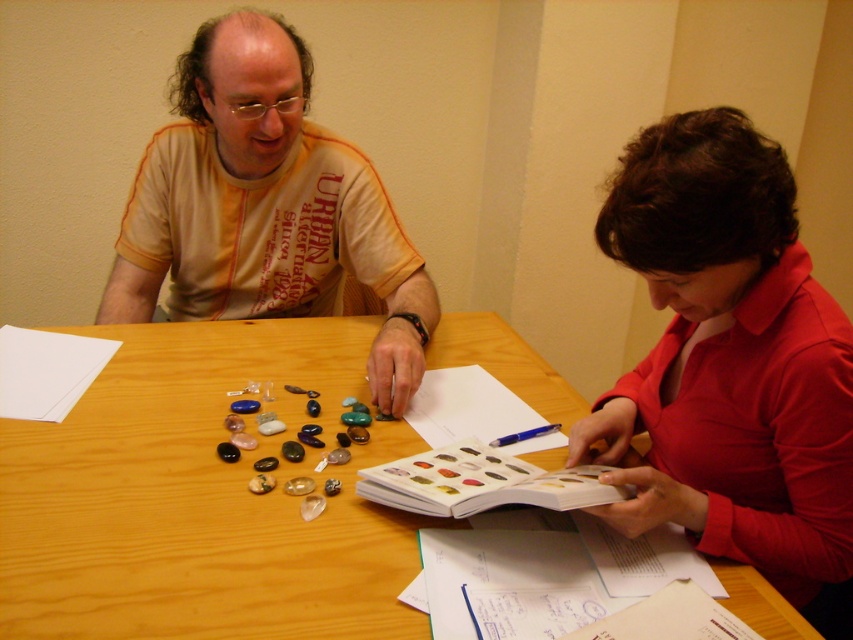
You are a student who needs to place a 12 inch notebook on the table. Can you fit it between the wooden table at center and the matte red blouse at center?

The wooden table at center and the matte red blouse at center are 14.01 inches apart from each other. Since the notebook is 12 inches wide, it can fit between them as the space is wider than the notebook.

You are a photographer trying to capture a closeup of the wooden table at center without any obstructions. Since the matte red blouse at center is in the way, can you lower your camera to take the photo?

The wooden table at center is below matte red blouse at center, so lowering the camera would allow you to capture the wooden table at center without the matte red blouse at center obstructing the view.